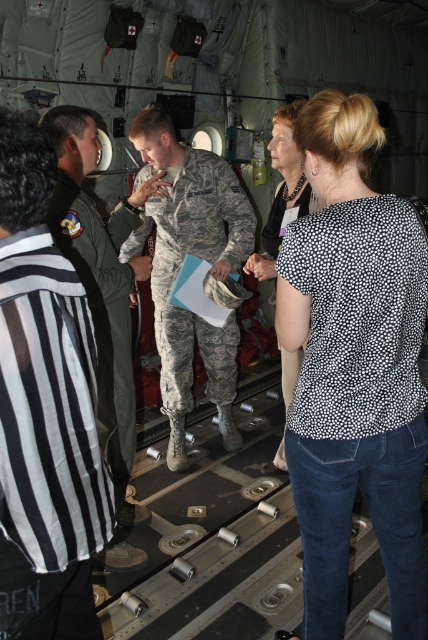
Is black striped shirt at left bigger than polka dot blouse at center?

Actually, black striped shirt at left might be smaller than polka dot blouse at center.

Is black striped shirt at left taller than polka dot blouse at center?

Correct, black striped shirt at left is much taller as polka dot blouse at center.

Describe the element at coordinates (44, 412) in the screenshot. I see `black striped shirt at left` at that location.

Locate an element on the screen. black striped shirt at left is located at coordinates (44, 412).

Measure the distance from black dotted shirt at upper right to camouflage uniform at center.

black dotted shirt at upper right and camouflage uniform at center are 1.50 meters apart from each other.

Is black dotted shirt at upper right bigger than camouflage uniform at center?

Actually, black dotted shirt at upper right might be smaller than camouflage uniform at center.

This screenshot has width=428, height=640. What are the coordinates of `black dotted shirt at upper right` in the screenshot? It's located at (357, 316).

Can you confirm if black dotted shirt at upper right is thinner than polka dot blouse at center?

No.

Is point (368, 406) behind point (279, 236)?

No, (368, 406) is in front of (279, 236).

Where is `black dotted shirt at upper right`? Image resolution: width=428 pixels, height=640 pixels. black dotted shirt at upper right is located at coordinates (357, 316).